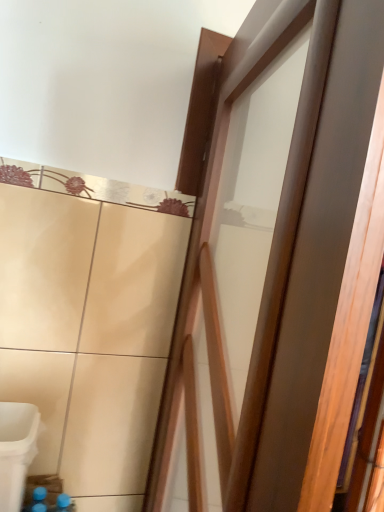
What is the approximate width of white plastic potty at lower left?

white plastic potty at lower left is 8.54 inches in width.

The height and width of the screenshot is (512, 384). In order to click on white plastic potty at lower left in this screenshot , I will do `click(16, 450)`.

Measure the distance between point (4, 457) and camera.

A distance of 33.19 inches exists between point (4, 457) and camera.

What do you see at coordinates (16, 450) in the screenshot? The width and height of the screenshot is (384, 512). I see `white plastic potty at lower left` at bounding box center [16, 450].

Image resolution: width=384 pixels, height=512 pixels. I want to click on white plastic potty at lower left, so coord(16,450).